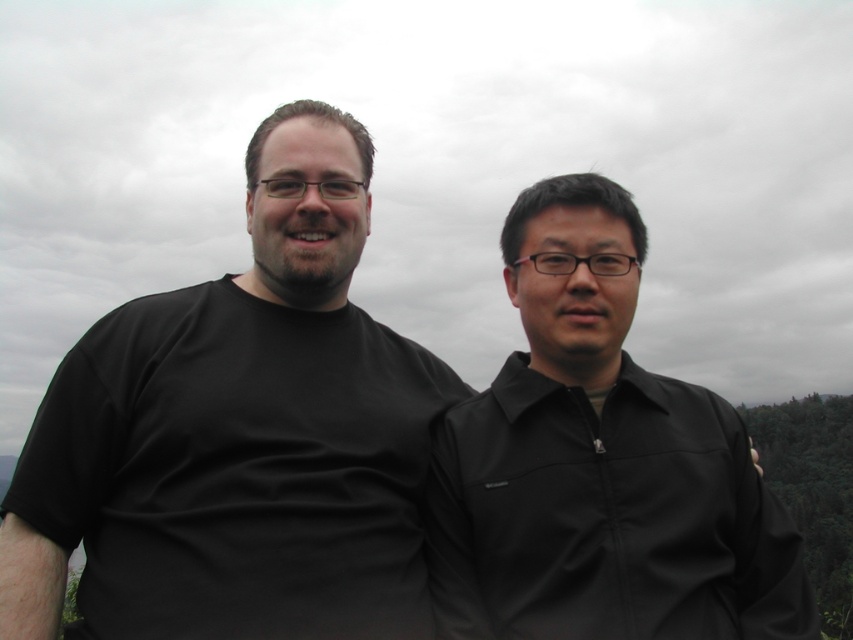
Is black matte t-shirt at left bigger than black matte shirt at right?

Incorrect, black matte t-shirt at left is not larger than black matte shirt at right.

Is point (39, 404) positioned in front of point (650, 547)?

No, it is not.

Find the location of a particular element. This screenshot has width=853, height=640. black matte t-shirt at left is located at coordinates (236, 470).